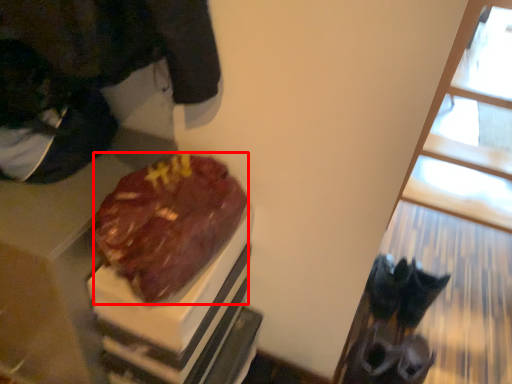
Question: From the image's perspective, where is chocolate cake (annotated by the red box) located relative to window?

Choices:
 (A) above
 (B) below

Answer: (B)